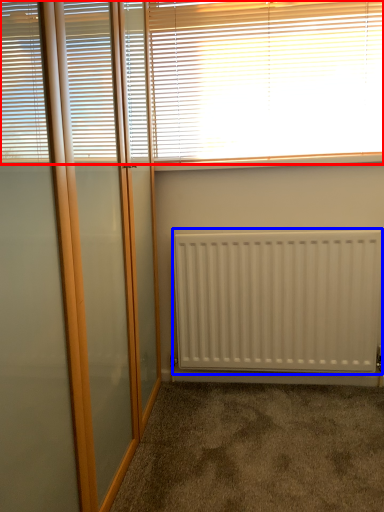
Question: Which point is further to the camera, window blind (highlighted by a red box) or radiator (highlighted by a blue box)?

Choices:
 (A) window blind
 (B) radiator

Answer: (B)